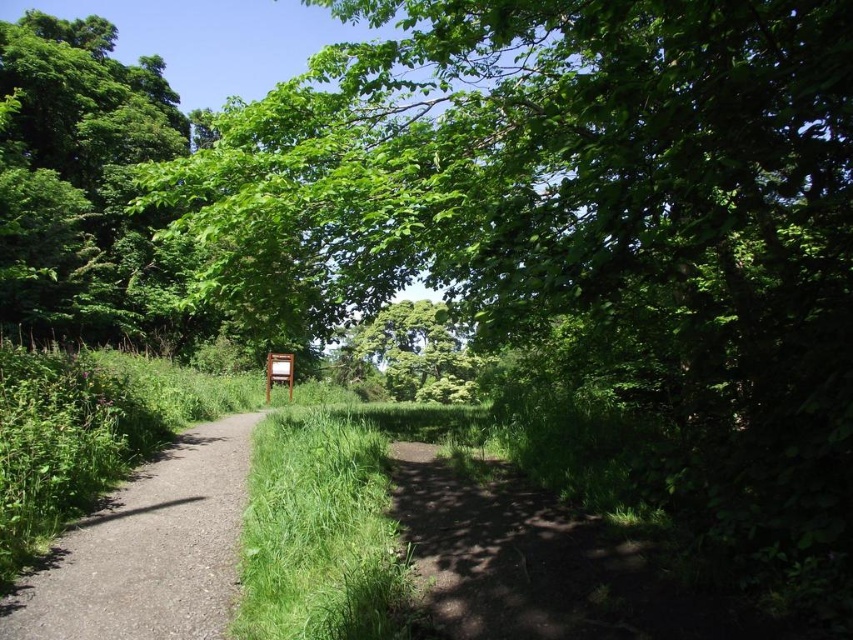
Based on the photo, can you confirm if green leafy tree at upper left is positioned above green grass at center?

Indeed, green leafy tree at upper left is positioned over green grass at center.

Measure the distance between green leafy tree at upper left and green grass at center.

green leafy tree at upper left and green grass at center are 56.70 feet apart.

Does point (90, 337) come behind point (303, 605)?

Yes, point (90, 337) is farther from viewer.

Find the location of a particular element. green leafy tree at upper left is located at coordinates (76, 177).

Describe the element at coordinates (148, 550) in the screenshot. The height and width of the screenshot is (640, 853). I see `dirt path at center` at that location.

The width and height of the screenshot is (853, 640). Identify the location of dirt path at center. (148, 550).

Can you confirm if green leafy tree at upper left is wider than dirt path at center?

Indeed, green leafy tree at upper left has a greater width compared to dirt path at center.

Can you confirm if green leafy tree at upper left is bigger than dirt path at center?

Correct, green leafy tree at upper left is larger in size than dirt path at center.

Is point (4, 90) closer to viewer compared to point (157, 520)?

No.

At what (x,y) coordinates should I click in order to perform the action: click on green leafy tree at upper left. Please return your answer as a coordinate pair (x, y). Image resolution: width=853 pixels, height=640 pixels. Looking at the image, I should click on (76, 177).